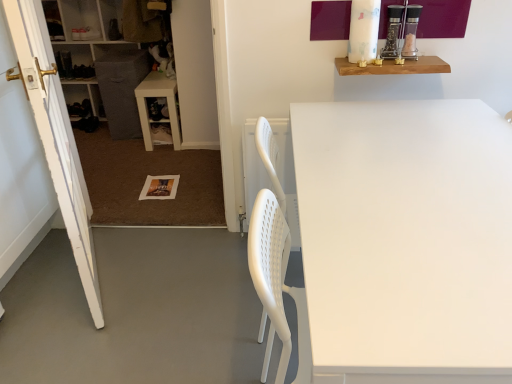
Find the location of a particular element. This screenshot has width=512, height=384. vacant location below white painted wood door at left (from a real-world perspective) is located at coordinates (100, 266).